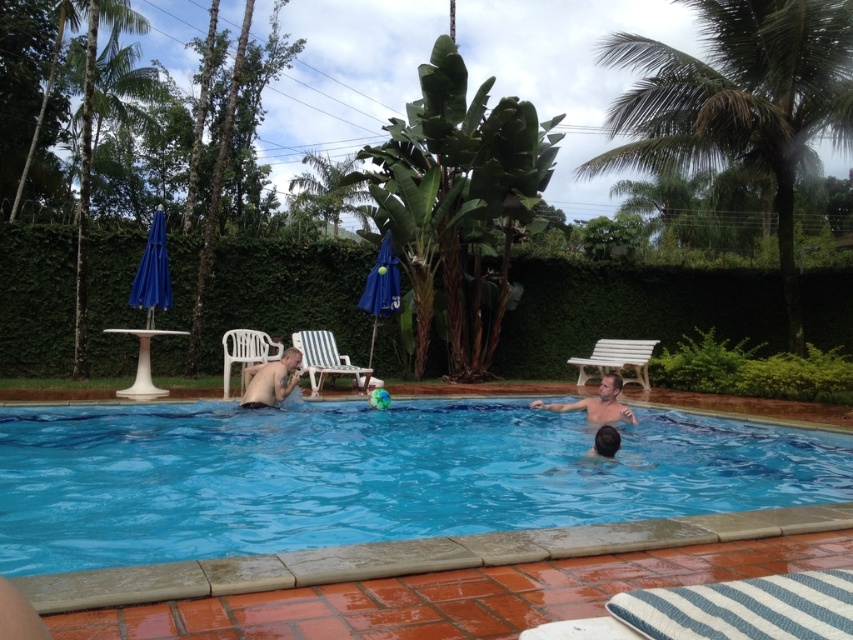
Between white striped plastic chair at center and white plastic chair at left, which one appears on the left side from the viewer's perspective?

From the viewer's perspective, white plastic chair at left appears more on the left side.

Does point (334, 355) come in front of point (245, 342)?

No, it is behind (245, 342).

Find the location of a particular element. Image resolution: width=853 pixels, height=640 pixels. white striped plastic chair at center is located at coordinates (x=325, y=358).

Image resolution: width=853 pixels, height=640 pixels. In order to click on white striped plastic chair at center in this screenshot , I will do `click(325, 358)`.

Between green leafy palm tree at center and white plastic bench at center, which one has more height?

green leafy palm tree at center

Who is higher up, green leafy palm tree at center or white plastic bench at center?

green leafy palm tree at center

Describe the element at coordinates (459, 204) in the screenshot. I see `green leafy palm tree at center` at that location.

Where is `green leafy palm tree at center`? The height and width of the screenshot is (640, 853). green leafy palm tree at center is located at coordinates (459, 204).

Between point (517, 472) and point (285, 390), which one is positioned behind?

Positioned behind is point (285, 390).

Can you confirm if blue smooth water at center is positioned to the right of shiny skin at lower center?

Correct, you'll find blue smooth water at center to the right of shiny skin at lower center.

Is point (641, 477) positioned after point (286, 362)?

That is False.

Where is `blue smooth water at center`? This screenshot has height=640, width=853. blue smooth water at center is located at coordinates (367, 476).